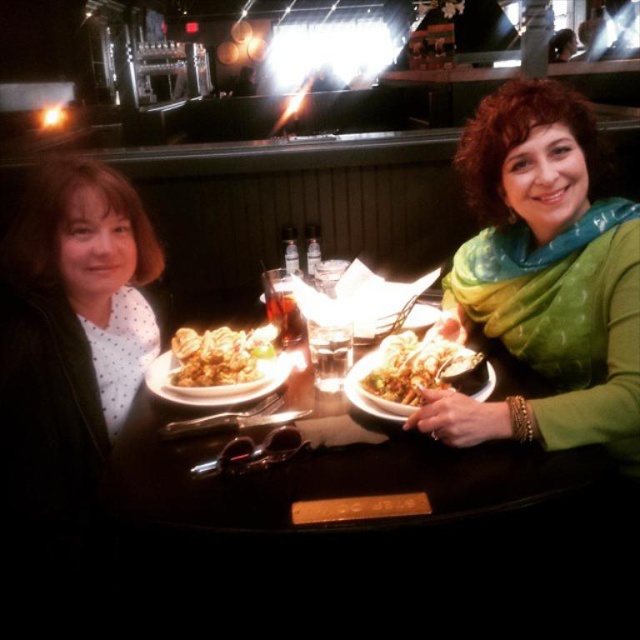
You are a photographer setting up a shot of the scene. You need to ensure that the green silk scarf at upper right is visible above the wooden table at center. Is the current arrangement allowing this?

Yes, the green silk scarf at upper right is located above the wooden table at center, so it is visible in the current arrangement.